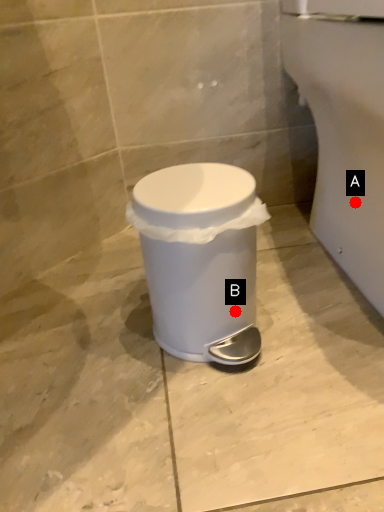
Question: Two points are circled on the image, labeled by A and B beside each circle. Which of the following is the farthest from the observer?

Choices:
 (A) A is further
 (B) B is further

Answer: (A)